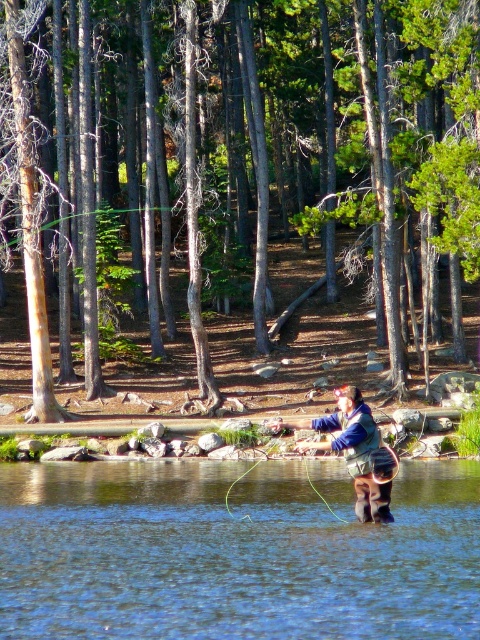
Based on the photo, you are a hiker who wants to cross the blue water at center while wearing the blue fleece jacket at center. Based on their widths, can you determine if the jacket will fit through the water without getting wet?

The blue water at center is wider than the blue fleece jacket at center, so yes, the jacket can fit through the water without getting wet.

You are a hiker who wants to cross the blue water at center while wearing the blue fleece jacket at center. Based on the scene, which direction should you move to avoid getting your jacket wet?

The blue water at center is positioned on the left side of the blue fleece jacket at center. To avoid getting your jacket wet, you should move to the right side of the blue fleece jacket at center, away from the water.